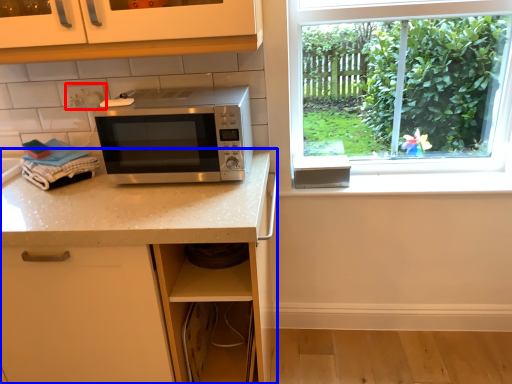
Question: Which object is further to the camera taking this photo, electric outlet (highlighted by a red box) or countertop (highlighted by a blue box)?

Choices:
 (A) electric outlet
 (B) countertop

Answer: (A)